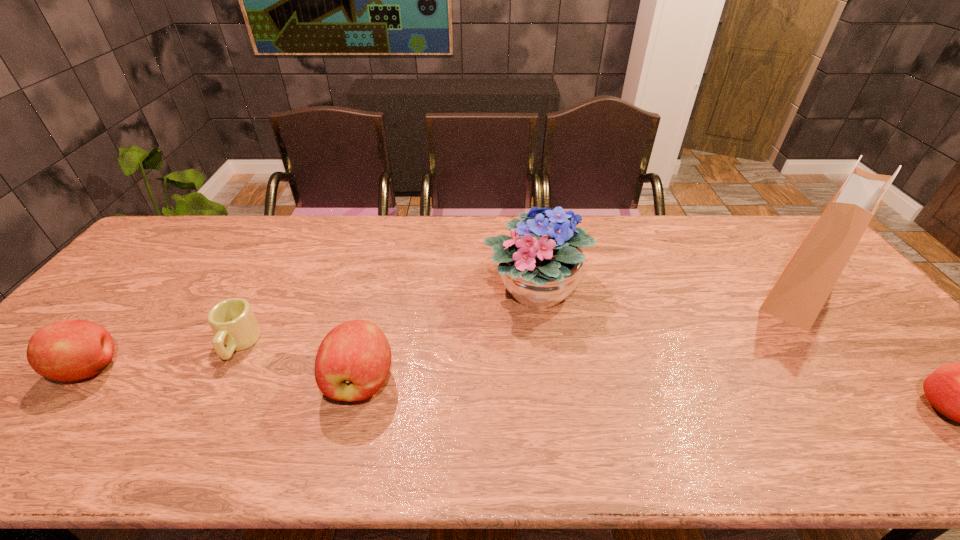
Where is `unoccupied position between the shortest object and the fourth tallest object`? This screenshot has width=960, height=540. unoccupied position between the shortest object and the fourth tallest object is located at coordinates (165, 356).

The width and height of the screenshot is (960, 540). I want to click on vacant space in between the shopping bag and the second apple from left to right, so click(580, 338).

At what (x,y) coordinates should I click in order to perform the action: click on vacant space that is in between the shopping bag and the fifth object from right to left. Please return your answer as a coordinate pair (x, y). Looking at the image, I should click on [x=518, y=319].

At what (x,y) coordinates should I click in order to perform the action: click on vacant point located between the fourth object from left to right and the shopping bag. Please return your answer as a coordinate pair (x, y). The image size is (960, 540). Looking at the image, I should click on (667, 292).

Where is `vacant area that lies between the third object from right to left and the tallest object`? This screenshot has height=540, width=960. vacant area that lies between the third object from right to left and the tallest object is located at coordinates (667, 292).

Locate an element on the screen. The width and height of the screenshot is (960, 540). free space between the second object from left to right and the shopping bag is located at coordinates (518, 319).

You are a GUI agent. You are given a task and a screenshot of the screen. Output one action in this format:
    pyautogui.click(x=<x>, y=<y>)
    Task: Click on the closest object to the fifth object from right to left
    The image size is (960, 540).
    Given the screenshot: What is the action you would take?
    pyautogui.click(x=68, y=350)

Point out which object is positioned as the fifth nearest to the second apple from left to right. Please provide its 2D coordinates. Your answer should be formatted as a tuple, i.e. [(x, y)], where the tuple contains the x and y coordinates of a point satisfying the conditions above.

[(959, 391)]

At what (x,y) coordinates should I click in order to perform the action: click on apple that stands as the second closest to the second object from left to right. Please return your answer as a coordinate pair (x, y). Image resolution: width=960 pixels, height=540 pixels. Looking at the image, I should click on (353, 361).

Point out which apple is positioned as the third nearest to the tallest object. Please provide its 2D coordinates. Your answer should be formatted as a tuple, i.e. [(x, y)], where the tuple contains the x and y coordinates of a point satisfying the conditions above.

[(68, 350)]